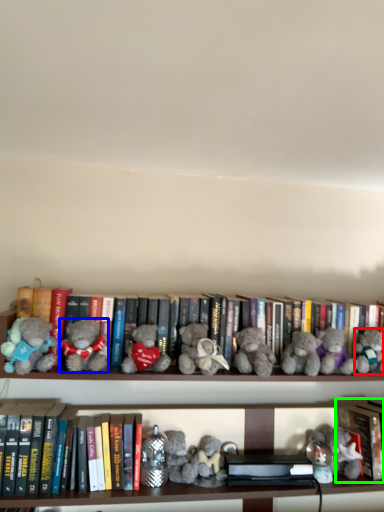
Question: Based on their relative distances, which object is farther from toy (highlighted by a red box)? Choose from teddy bear (highlighted by a blue box) and book (highlighted by a green box).

Choices:
 (A) teddy bear
 (B) book

Answer: (A)